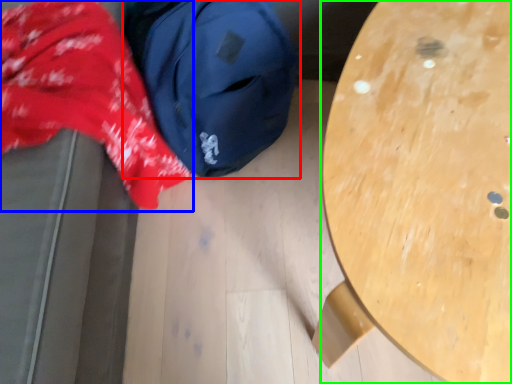
Question: Based on their relative distances, which object is farther from backpack (highlighted by a red box)? Choose from clothing (highlighted by a blue box) and table (highlighted by a green box).

Choices:
 (A) clothing
 (B) table

Answer: (B)